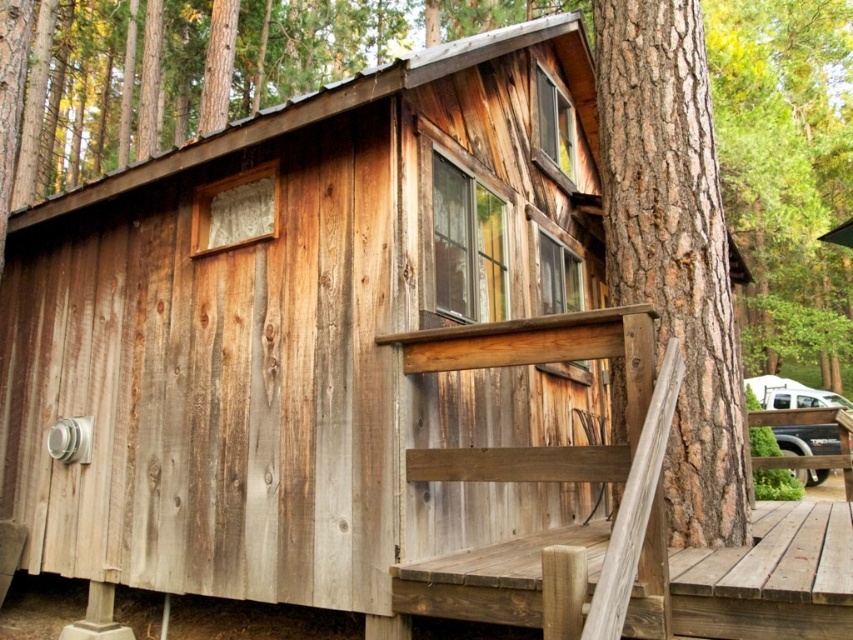
Question: Can you confirm if rough bark tree trunk at center is smaller than weathered wood deck at lower right?

Choices:
 (A) no
 (B) yes

Answer: (B)

Question: Can you confirm if rough bark tree trunk at center is positioned above weathered wood deck at lower right?

Choices:
 (A) no
 (B) yes

Answer: (B)

Question: Is rough bark tree trunk at center smaller than weathered wood deck at lower right?

Choices:
 (A) no
 (B) yes

Answer: (B)

Question: Which point is closer to the camera?

Choices:
 (A) weathered wood deck at lower right
 (B) rough bark tree trunk at center

Answer: (A)

Question: Which point appears farthest from the camera in this image?

Choices:
 (A) (680, 38)
 (B) (525, 556)

Answer: (A)